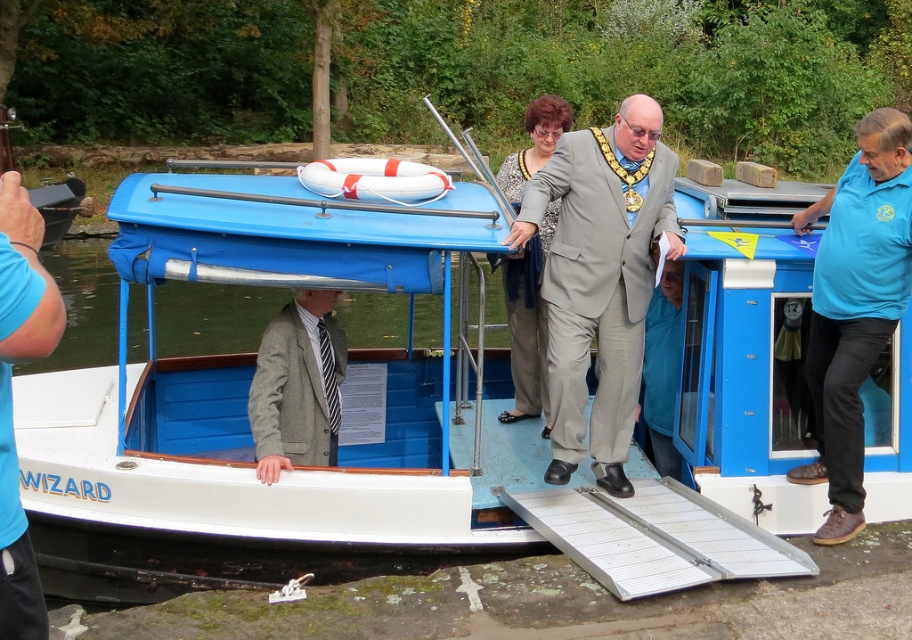
You are a photographer positioned at the riverside. You need to take a photo of the gray woolen blazer at center and the blue cotton shirt at right. Which one should you adjust your camera angle to capture first if you want to include both in the frame without moving the subjects?

You should adjust your camera angle to capture the gray woolen blazer at center first because the blue cotton shirt at right is to the right of it, so by centering on the blazer, you can widen the angle to include the shirt on the right side of the frame.

You are a photographer positioned on the boat and want to take a photo of both the blue cotton shirt at right and the gray suit at center. Which one should you focus on first to ensure both are in sharp focus?

The blue cotton shirt at right is closer to the viewer than the gray suit at center. To ensure both are in sharp focus, you should focus on the blue cotton shirt at right first because it is closer, and then adjust the focus to include the gray suit at center within the depth of field.

What is the exact coordinate of the gray fabric suit at center?

→ The gray fabric suit at center is located exactly at point (600, 278).